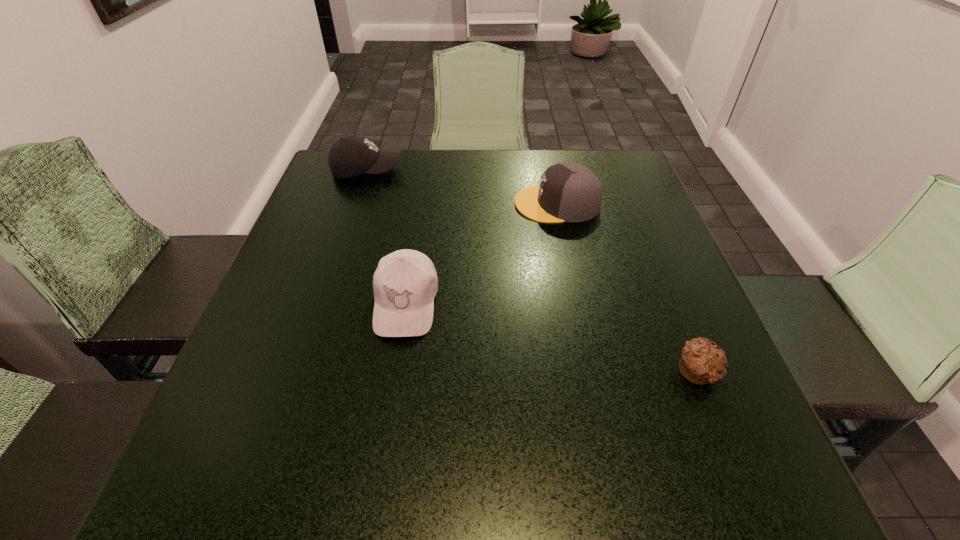
Find the location of `the farthest object`. the farthest object is located at coordinates (352, 155).

The image size is (960, 540). Identify the location of the leftmost object. (352, 155).

Locate an element on the screen. cap is located at coordinates (568, 192).

Locate an element on the screen. The height and width of the screenshot is (540, 960). the second farthest object is located at coordinates point(568,192).

Locate an element on the screen. the nearer baseball cap is located at coordinates (405, 282).

Locate an element on the screen. The image size is (960, 540). the third object from right to left is located at coordinates (405, 282).

At what (x,y) coordinates should I click in order to perform the action: click on muffin. Please return your answer as a coordinate pair (x, y). This screenshot has height=540, width=960. Looking at the image, I should click on (701, 362).

Identify the location of the rightmost object. (701, 362).

The width and height of the screenshot is (960, 540). Find the location of `free spot located on the front-facing side of the farther baseball cap`. free spot located on the front-facing side of the farther baseball cap is located at coordinates (475, 170).

Where is `vacant space situated on the front-facing side of the third object from left to right`? vacant space situated on the front-facing side of the third object from left to right is located at coordinates (382, 204).